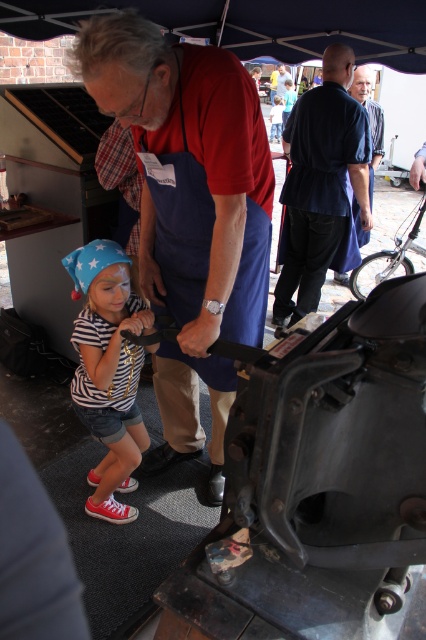
Who is more forward, (158, 396) or (299, 109)?

Point (158, 396)

Is blue apron at center thinner than dark blue fabric shirt at center?

Correct, blue apron at center's width is less than dark blue fabric shirt at center's.

The width and height of the screenshot is (426, 640). What do you see at coordinates (189, 211) in the screenshot?
I see `blue apron at center` at bounding box center [189, 211].

The image size is (426, 640). I want to click on blue apron at center, so click(189, 211).

Which is more to the right, striped cotton shirt at lower left or dark blue shirt at upper center?

dark blue shirt at upper center is more to the right.

Between point (103, 397) and point (373, 106), which one is positioned behind?

Point (373, 106)

I want to click on striped cotton shirt at lower left, so click(109, 371).

Who is more forward, (195, 262) or (89, 344)?

Point (195, 262) is more forward.

From the picture: Which of these two, blue apron at center or striped cotton shirt at lower left, stands shorter?

Standing shorter between the two is striped cotton shirt at lower left.

Image resolution: width=426 pixels, height=640 pixels. Identify the location of blue apron at center. (x=189, y=211).